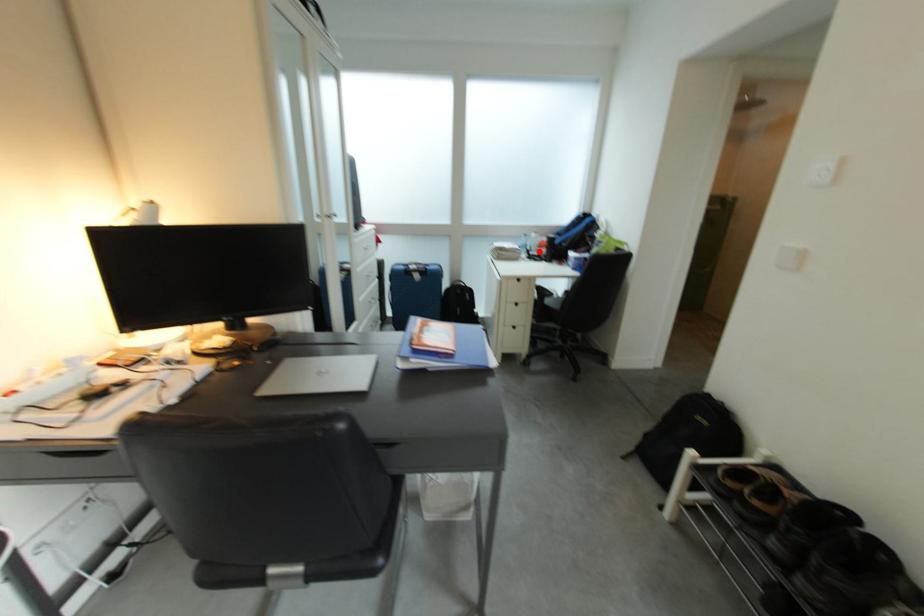
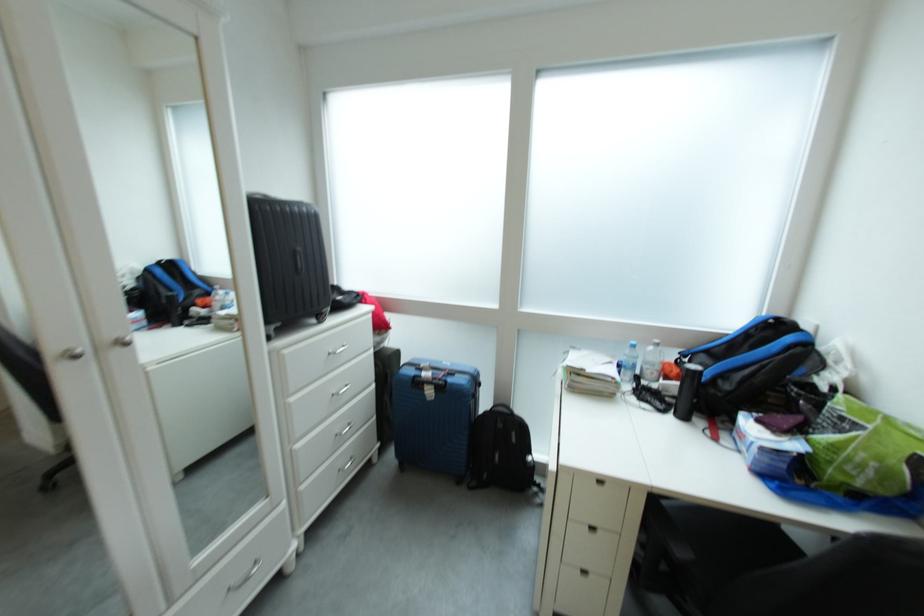
Find the pixel in the second image that matches the highlighted location in the first image.

(650, 376)